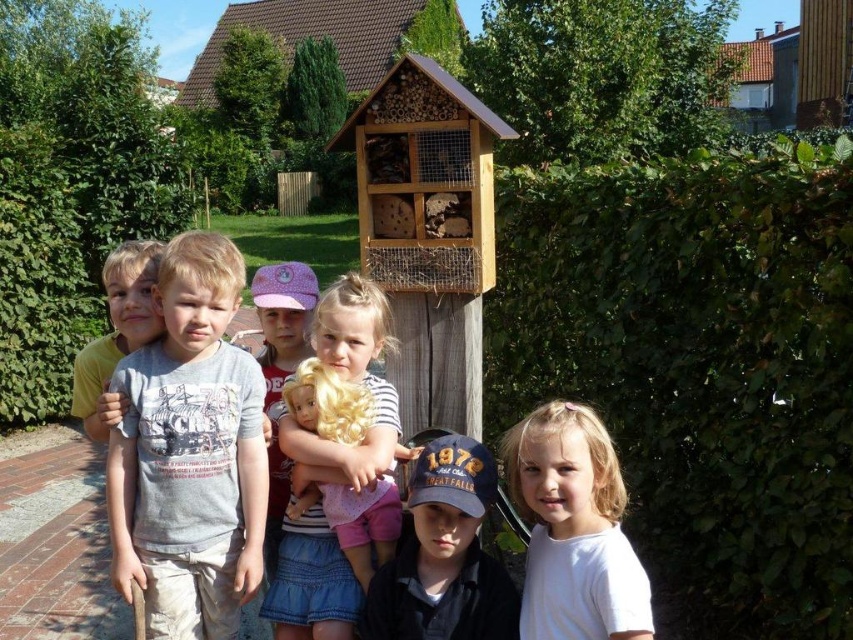
Question: Which point is closer to the camera taking this photo?

Choices:
 (A) (107, 342)
 (B) (299, 433)
 (C) (792, 500)
 (D) (157, 301)

Answer: (D)

Question: Considering the real-world distances, which object is closest to the gray cotton shirt at center?

Choices:
 (A) matte blonde wig at center
 (B) green leafy hedge at left
 (C) green leafy hedge at upper right
 (D) light brown hair at center

Answer: (D)

Question: Based on their relative distances, which object is nearer to the green leafy hedge at upper right?

Choices:
 (A) green leafy hedge at left
 (B) gray cotton shirt at center
 (C) matte blonde wig at center

Answer: (C)

Question: Can you confirm if green leafy hedge at upper right is positioned below gray cotton shirt at center?

Choices:
 (A) no
 (B) yes

Answer: (A)

Question: Is white matte shirt at center to the right of matte blonde wig at center from the viewer's perspective?

Choices:
 (A) no
 (B) yes

Answer: (B)

Question: From the image, what is the correct spatial relationship of green leafy hedge at left in relation to gray cotton shirt at center?

Choices:
 (A) above
 (B) below

Answer: (A)